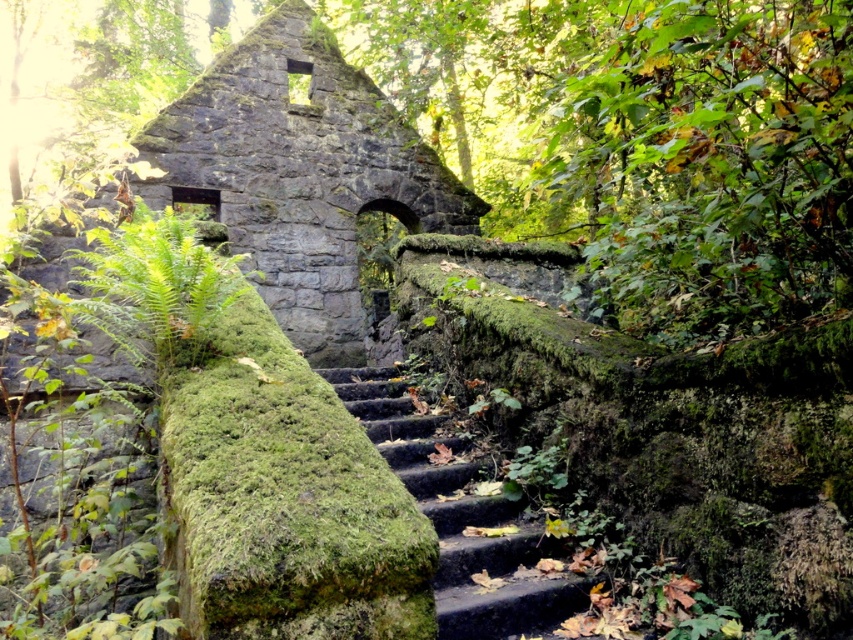
Question: From the image, what is the correct spatial relationship of moss-covered stone stairs at center in relation to green mossy fern at center?

Choices:
 (A) right
 (B) left

Answer: (A)

Question: Does rusty stone ruins at center have a greater width compared to green mossy fern at center?

Choices:
 (A) yes
 (B) no

Answer: (A)

Question: Estimate the real-world distances between objects in this image. Which object is closer to the green mossy fern at center?

Choices:
 (A) rusty stone ruins at center
 (B) moss-covered stone stairs at center

Answer: (B)

Question: Which point is closer to the camera taking this photo?

Choices:
 (A) (164, 125)
 (B) (149, 220)
 (C) (440, 625)

Answer: (C)

Question: Estimate the real-world distances between objects in this image. Which object is farther from the green mossy fern at center?

Choices:
 (A) rusty stone ruins at center
 (B) moss-covered stone stairs at center

Answer: (A)

Question: Is moss-covered stone stairs at center thinner than green mossy fern at center?

Choices:
 (A) no
 (B) yes

Answer: (B)